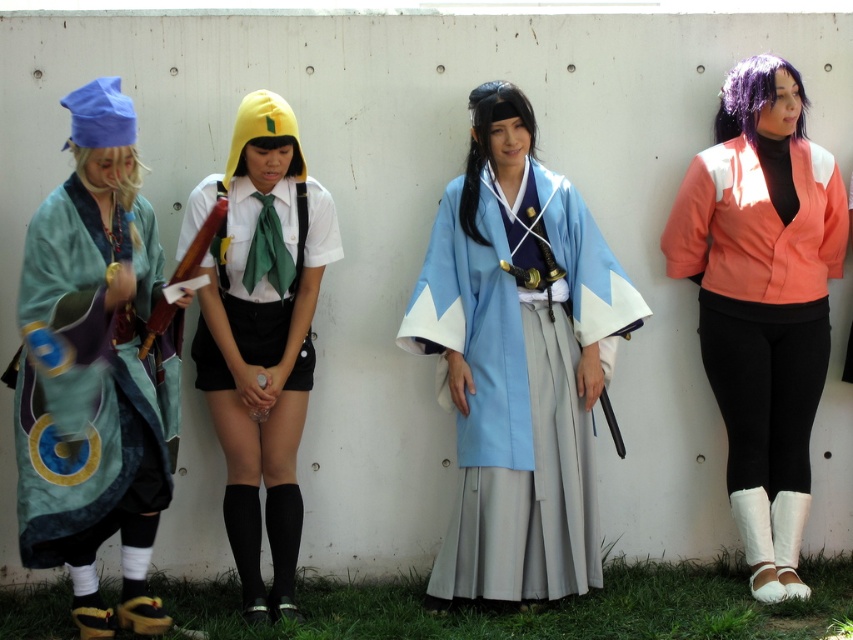
Question: From the image, what is the correct spatial relationship of light blue silk kimono at center in relation to white matte uniform at center?

Choices:
 (A) left
 (B) right

Answer: (B)

Question: Which of the following is the farthest from the observer?

Choices:
 (A) orange fabric jacket at right
 (B) light blue silk kimono at center
 (C) white matte uniform at center
 (D) teal silk kimono at left

Answer: (A)

Question: Is the position of light blue silk kimono at center less distant than that of white matte uniform at center?

Choices:
 (A) yes
 (B) no

Answer: (B)

Question: Estimate the real-world distances between objects in this image. Which object is farther from the teal silk kimono at left?

Choices:
 (A) orange fabric jacket at right
 (B) light blue silk kimono at center
 (C) white matte uniform at center

Answer: (A)

Question: Which of these objects is positioned closest to the light blue silk kimono at center?

Choices:
 (A) orange fabric jacket at right
 (B) white matte uniform at center
 (C) teal silk kimono at left

Answer: (A)

Question: Is teal silk kimono at left thinner than orange fabric jacket at right?

Choices:
 (A) no
 (B) yes

Answer: (B)